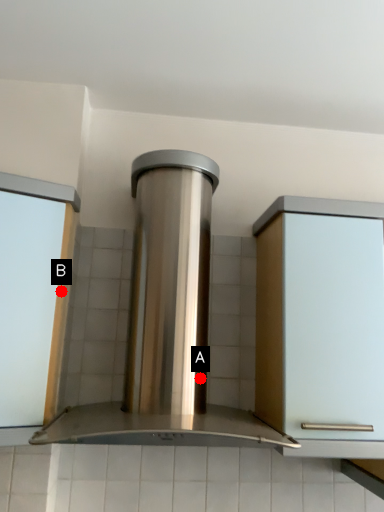
Question: Two points are circled on the image, labeled by A and B beside each circle. Which point is further to the camera?

Choices:
 (A) A is further
 (B) B is further

Answer: (A)